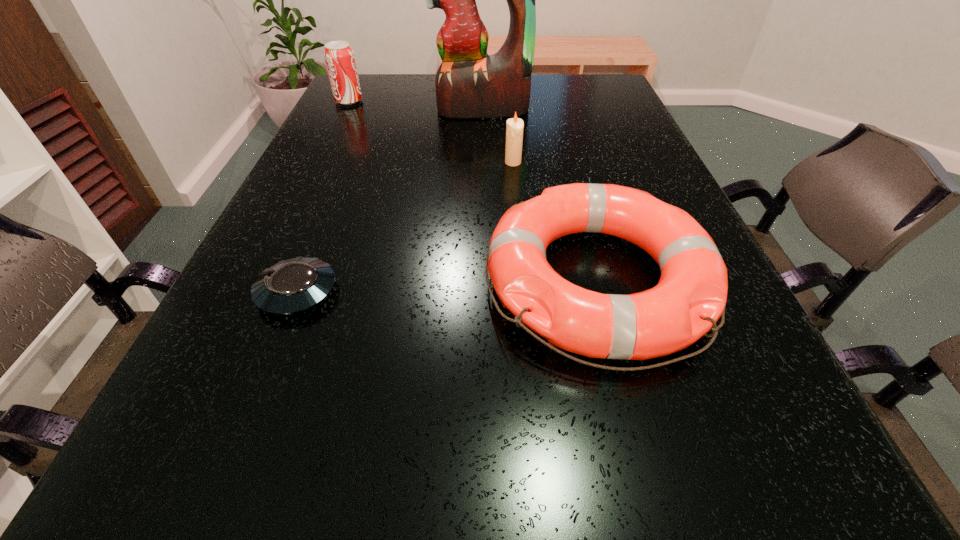
Where is `free space at the right edge`? free space at the right edge is located at coordinates (671, 399).

Identify the location of vacant space at the far left corner of the desktop. [379, 93].

Find the location of a particular element. Image resolution: width=960 pixels, height=540 pixels. vacant area at the near left corner is located at coordinates [x=191, y=489].

Image resolution: width=960 pixels, height=540 pixels. Identify the location of blank space at the far right corner of the desktop. (594, 99).

Where is `vacant space that's between the second tallest object and the second shortest object`? The height and width of the screenshot is (540, 960). vacant space that's between the second tallest object and the second shortest object is located at coordinates [x=472, y=191].

Find the location of `free space between the life buoy and the soda can`. free space between the life buoy and the soda can is located at coordinates (472, 191).

In order to click on free space between the candle and the parrot in this screenshot , I will do `click(498, 137)`.

Image resolution: width=960 pixels, height=540 pixels. Identify the location of blank region between the third nearest object and the parrot. (498, 137).

In order to click on free spot between the fourth shortest object and the candle in this screenshot , I will do tap(431, 132).

Locate an element on the screen. vacant space that's between the parrot and the saucer is located at coordinates (390, 201).